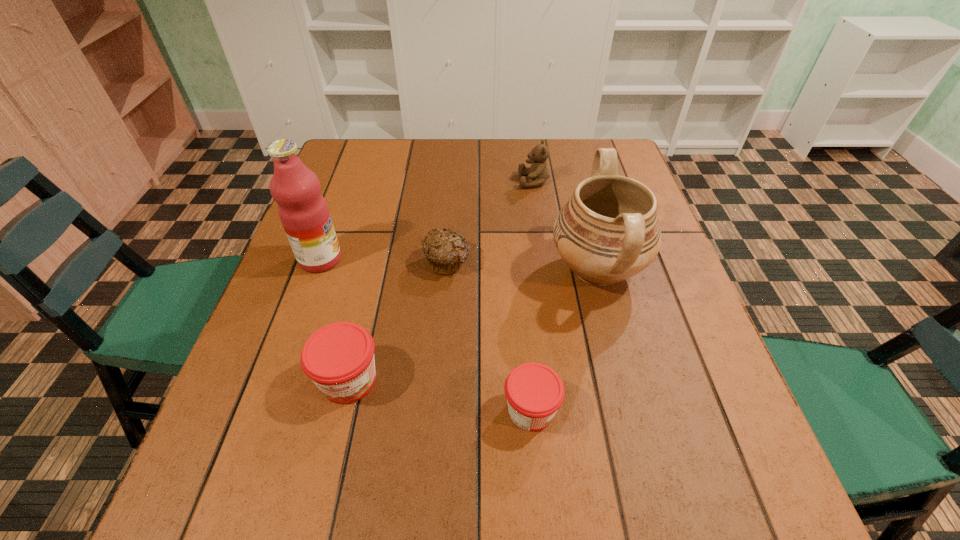
Find the location of `fruit juice present at the left edge`. fruit juice present at the left edge is located at coordinates (303, 211).

Locate an element on the screen. The width and height of the screenshot is (960, 540). object present at the right edge is located at coordinates (608, 231).

This screenshot has width=960, height=540. What are the coordinates of `object at the near left corner` in the screenshot? It's located at (339, 358).

This screenshot has width=960, height=540. Identify the location of free space at the far edge. (392, 141).

Locate an element on the screen. free space at the near edge of the desktop is located at coordinates (311, 444).

Find the location of a particular element. vacant space at the left edge of the desktop is located at coordinates (240, 384).

You are a GUI agent. You are given a task and a screenshot of the screen. Output one action in this format:
    pyautogui.click(x=<x>, y=<y>)
    Task: Click on the vacant space at the right edge of the desktop
    The image size is (960, 540).
    Given the screenshot: What is the action you would take?
    pyautogui.click(x=682, y=307)

Find the location of `blank space at the far left corner of the desktop`. blank space at the far left corner of the desktop is located at coordinates (376, 161).

Find the location of a particular element. The width and height of the screenshot is (960, 540). vacant space at the near left corner of the desktop is located at coordinates (261, 415).

Where is `unoccupied area between the farthest object and the taller jam`? The image size is (960, 540). unoccupied area between the farthest object and the taller jam is located at coordinates (442, 280).